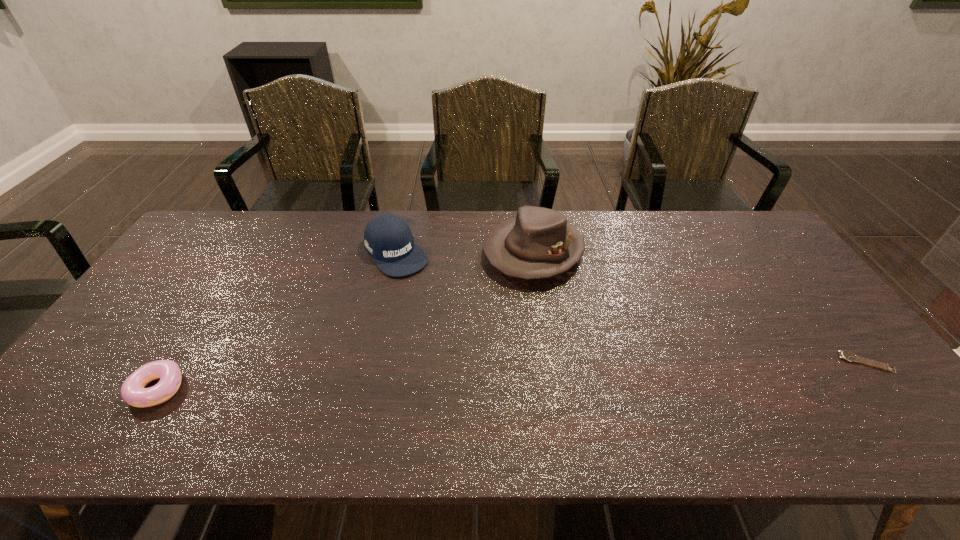
At what (x,y) coordinates should I click in order to perform the action: click on free spot between the second tallest object and the tallest object. Please return your answer as a coordinate pair (x, y). This screenshot has height=540, width=960. Looking at the image, I should click on (465, 253).

This screenshot has width=960, height=540. Identify the location of vacant space that's between the rightmost object and the third tallest object. (512, 376).

Where is `free space between the second tallest object and the doughnut`? free space between the second tallest object and the doughnut is located at coordinates [x=277, y=321].

Locate an element on the screen. vacant area between the doughnut and the hat is located at coordinates (346, 320).

Where is `free space between the rightmost object and the tallest object`? free space between the rightmost object and the tallest object is located at coordinates (700, 307).

Where is `vacant space in between the hat and the baseball cap`? This screenshot has height=540, width=960. vacant space in between the hat and the baseball cap is located at coordinates (x=465, y=253).

The image size is (960, 540). What are the coordinates of `free space between the third object from left to right and the doughnut` in the screenshot? It's located at click(x=346, y=320).

The width and height of the screenshot is (960, 540). I want to click on empty space between the leftmost object and the third shortest object, so click(x=277, y=321).

Find the location of a particular element. free space between the third object from left to right and the doughnut is located at coordinates (346, 320).

The height and width of the screenshot is (540, 960). What are the coordinates of `vacant area that lies between the leftmost object and the third object from right to left` in the screenshot? It's located at (277, 321).